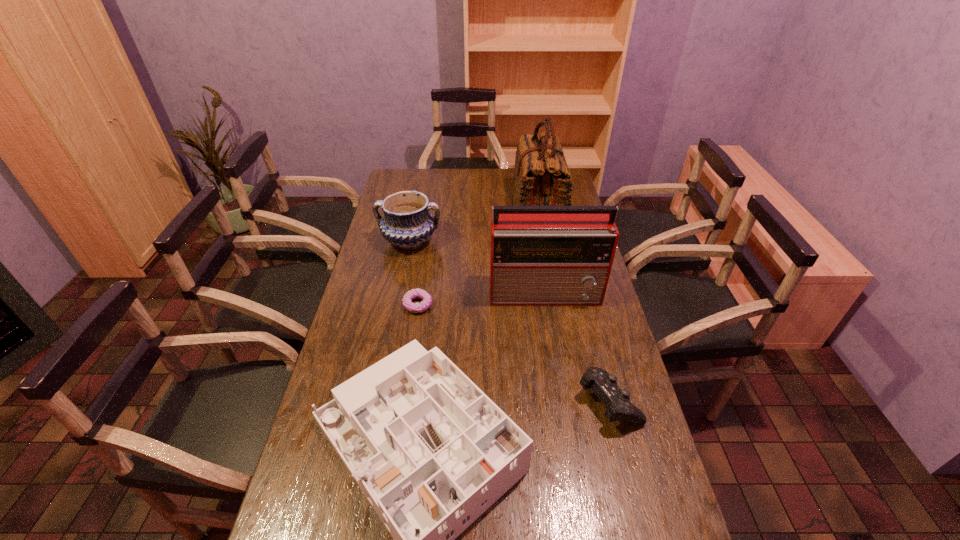
This screenshot has width=960, height=540. What are the coordinates of `vacant space at the right edge of the desktop` in the screenshot? It's located at (597, 441).

I want to click on free space between the pottery and the radio receiver, so click(478, 267).

Where is `unoccupied area between the second shortest object and the fourth shortest object`? The width and height of the screenshot is (960, 540). unoccupied area between the second shortest object and the fourth shortest object is located at coordinates click(x=509, y=321).

Locate an element on the screen. The image size is (960, 540). free spot between the shortest object and the shopping bag is located at coordinates (478, 256).

Find the location of `free space between the pottery and the fifth tallest object`. free space between the pottery and the fifth tallest object is located at coordinates (509, 321).

Locate an element on the screen. vacant area that lies between the shortest object and the control is located at coordinates point(513,353).

Identify the location of unoccupied position between the control and the shortest object. (513, 353).

What are the coordinates of `free space between the shortest object and the shopping bag` in the screenshot? It's located at (478, 256).

In order to click on free area in between the shopping bag and the doughnut in this screenshot , I will do `click(478, 256)`.

Where is `vacant space in between the shortest object and the third tallest object`? vacant space in between the shortest object and the third tallest object is located at coordinates (414, 273).